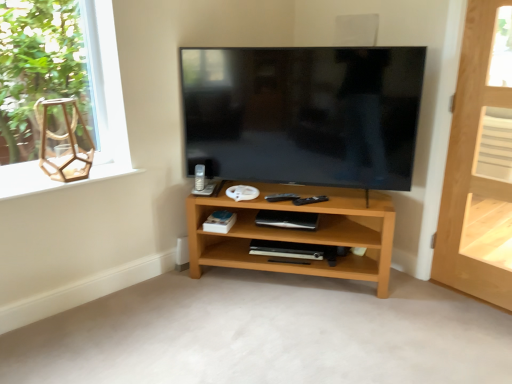
The image size is (512, 384). I want to click on free location above wooden hexagon at upper left (from a real-world perspective), so click(x=66, y=176).